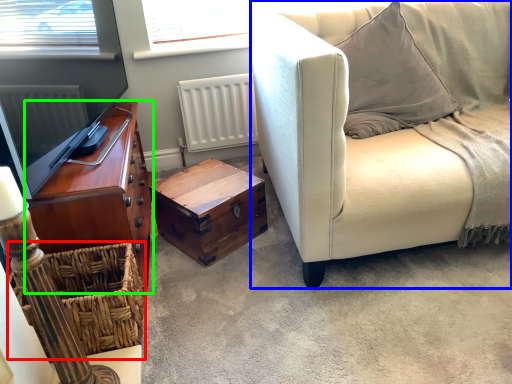
Question: Considering the real-world distances, which object is farthest from crate (highlighted by a red box)? studio couch (highlighted by a blue box) or cabinetry (highlighted by a green box)?

Choices:
 (A) studio couch
 (B) cabinetry

Answer: (A)